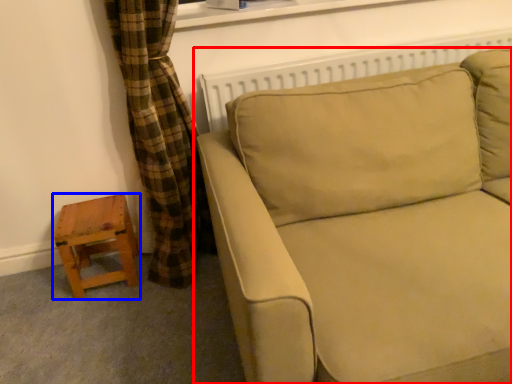
Question: Which object appears farthest to the camera in this image, studio couch (highlighted by a red box) or stool (highlighted by a blue box)?

Choices:
 (A) studio couch
 (B) stool

Answer: (B)